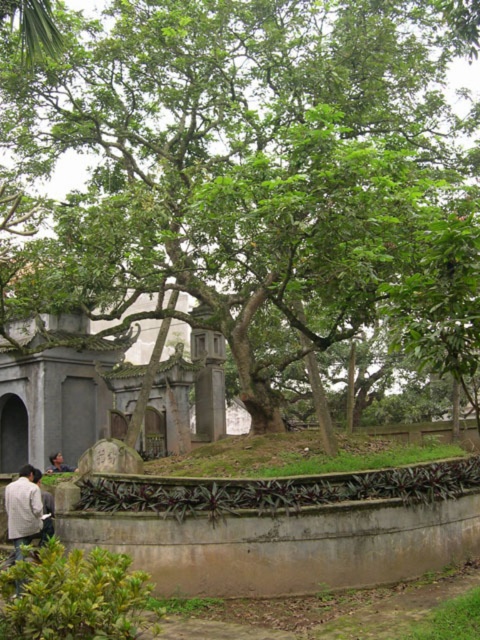
Between point (286, 154) and point (69, 467), which one is positioned in front?

Point (286, 154) is in front.

Who is positioned more to the right, green leafy tree at center or light brown wooden head at center?

Positioned to the right is green leafy tree at center.

Which is behind, point (384, 205) or point (52, 458)?

Point (52, 458)

You are a GUI agent. You are given a task and a screenshot of the screen. Output one action in this format:
    pyautogui.click(x=<x>, y=<y>)
    Task: Click on the green leafy tree at center
    The image size is (480, 640).
    Given the screenshot: What is the action you would take?
    pyautogui.click(x=239, y=148)

Who is lower down, white cotton shirt at lower left or light brown wooden head at center?

light brown wooden head at center is below.

Between white cotton shirt at lower left and light brown wooden head at center, which one has less height?

light brown wooden head at center is shorter.

Identify the location of white cotton shirt at lower left. (45, 508).

At what (x,y) coordinates should I click in order to perform the action: click on white cotton shirt at lower left. Please return your answer as a coordinate pair (x, y). Looking at the image, I should click on (45, 508).

Is light brown leather jacket at lower left positioned before light brown wooden head at center?

Yes.

Is the position of light brown leather jacket at lower left more distant than that of light brown wooden head at center?

No, light brown leather jacket at lower left is closer to the viewer.

Image resolution: width=480 pixels, height=640 pixels. In order to click on light brown leather jacket at lower left in this screenshot , I will do `click(23, 509)`.